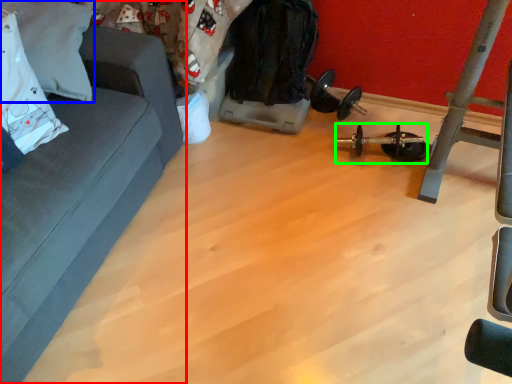
Question: Considering the real-world distances, which object is farthest from studio couch (highlighted by a red box)? pillow (highlighted by a blue box) or equipment (highlighted by a green box)?

Choices:
 (A) pillow
 (B) equipment

Answer: (B)